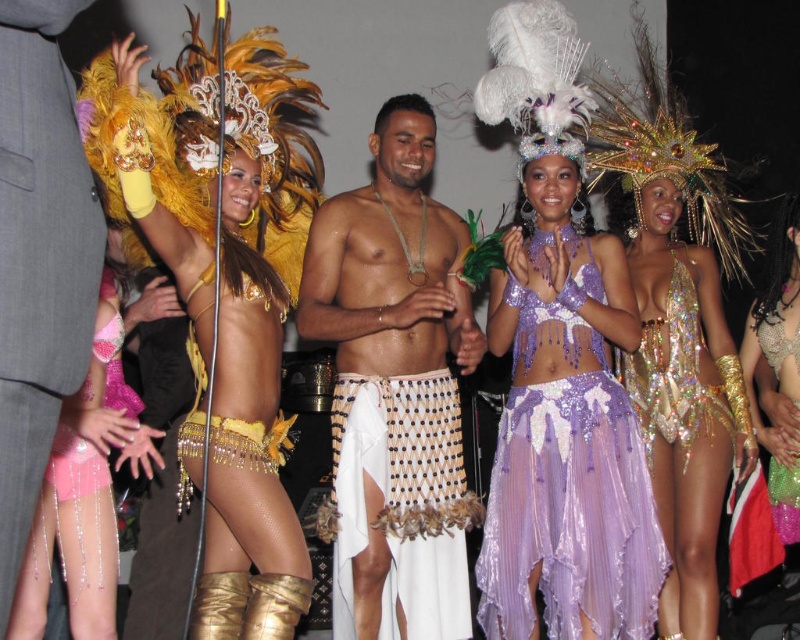
Between shiny gold skirt at center and purple sequined dress at center, which one has more height?

shiny gold skirt at center

Is shiny gold skirt at center above purple sequined dress at center?

Indeed, shiny gold skirt at center is positioned over purple sequined dress at center.

Is point (382, 189) in front of point (494, 493)?

No, it is not.

In order to click on shiny gold skirt at center in this screenshot , I will do `click(394, 388)`.

Does holographic sequin bodysuit at center lie in front of holographic sequin top at center?

Yes, it is.

Looking at this image, is holographic sequin bodysuit at center thinner than holographic sequin top at center?

No, holographic sequin bodysuit at center is not thinner than holographic sequin top at center.

Locate an element on the screen. The width and height of the screenshot is (800, 640). holographic sequin bodysuit at center is located at coordinates (684, 401).

Identify the location of holographic sequin bodysuit at center. (684, 401).

At what (x,y) coordinates should I click in order to perform the action: click on pink sequined shorts at lower left. Please return your answer as a coordinate pair (x, y). This screenshot has width=800, height=640. Looking at the image, I should click on (85, 486).

Consider the image. Who is shorter, pink sequined shorts at lower left or holographic sequin top at center?

holographic sequin top at center is shorter.

Locate an element on the screen. The height and width of the screenshot is (640, 800). pink sequined shorts at lower left is located at coordinates (85, 486).

Where is `pink sequined shorts at lower left`? This screenshot has width=800, height=640. pink sequined shorts at lower left is located at coordinates (85, 486).